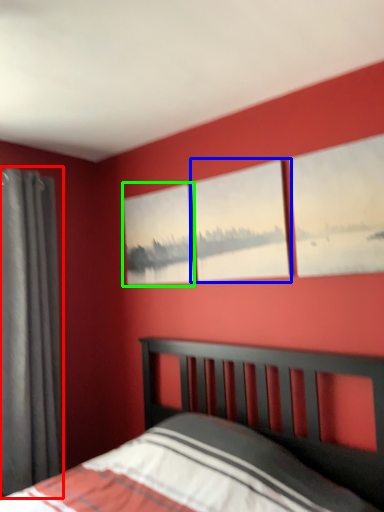
Question: Considering the real-world distances, which object is farthest from curtain (highlighted by a red box)? window (highlighted by a blue box) or picture frame (highlighted by a green box)?

Choices:
 (A) window
 (B) picture frame

Answer: (A)